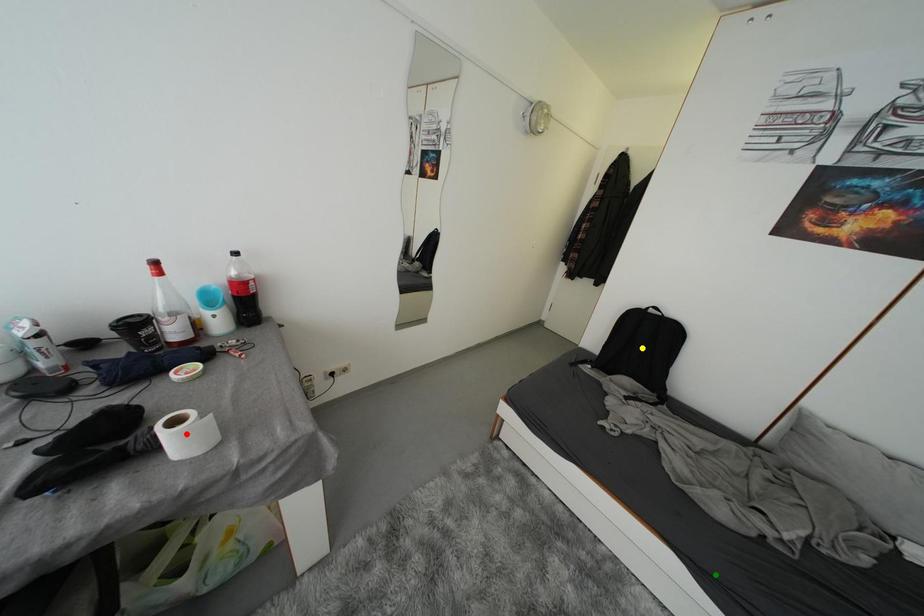
Order these from nearest to farthest:
- yellow point
- red point
- green point

1. red point
2. green point
3. yellow point